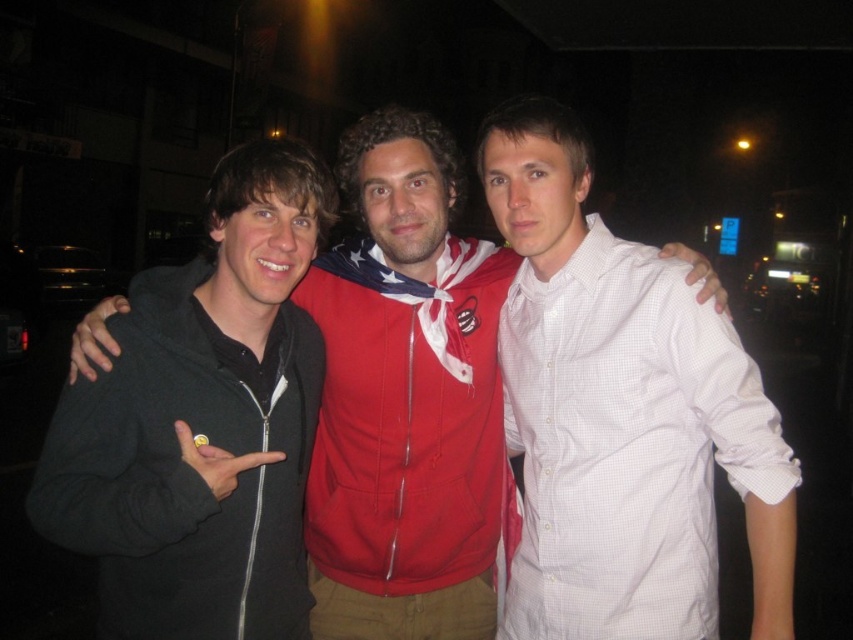
Question: Is white checkered shirt at center in front of red hoodie at center?

Choices:
 (A) no
 (B) yes

Answer: (B)

Question: Among these objects, which one is farthest from the camera?

Choices:
 (A) black zip-up hoodie at left
 (B) red hoodie at center

Answer: (B)

Question: Which object is the farthest from the black zip-up hoodie at left?

Choices:
 (A) white checkered shirt at center
 (B) red hoodie at center

Answer: (A)

Question: Observing the image, what is the correct spatial positioning of white checkered shirt at center in reference to black zip-up hoodie at left?

Choices:
 (A) right
 (B) left

Answer: (A)

Question: Is white checkered shirt at center to the left of red hoodie at center from the viewer's perspective?

Choices:
 (A) yes
 (B) no

Answer: (B)

Question: Which object appears farthest from the camera in this image?

Choices:
 (A) black zip-up hoodie at left
 (B) white checkered shirt at center
 (C) red hoodie at center

Answer: (C)